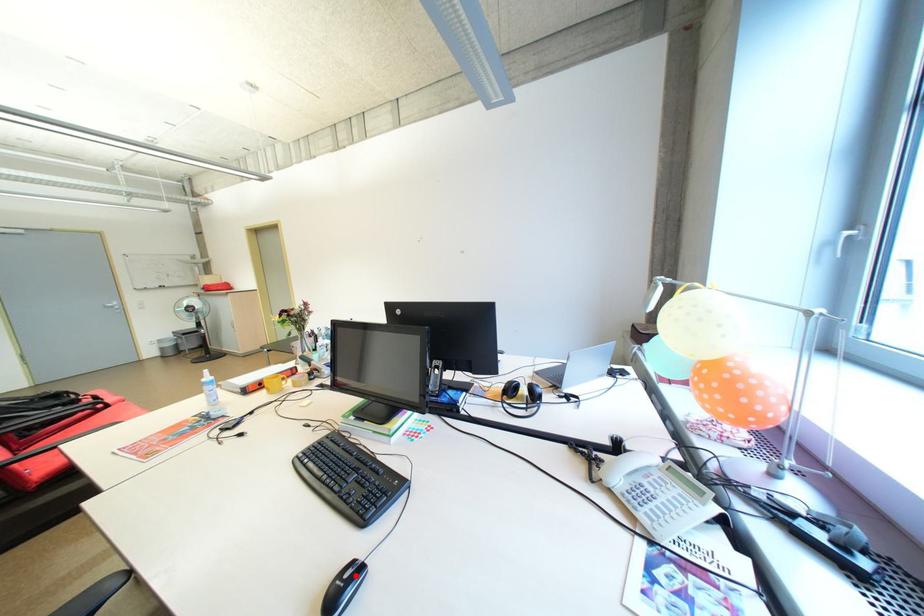
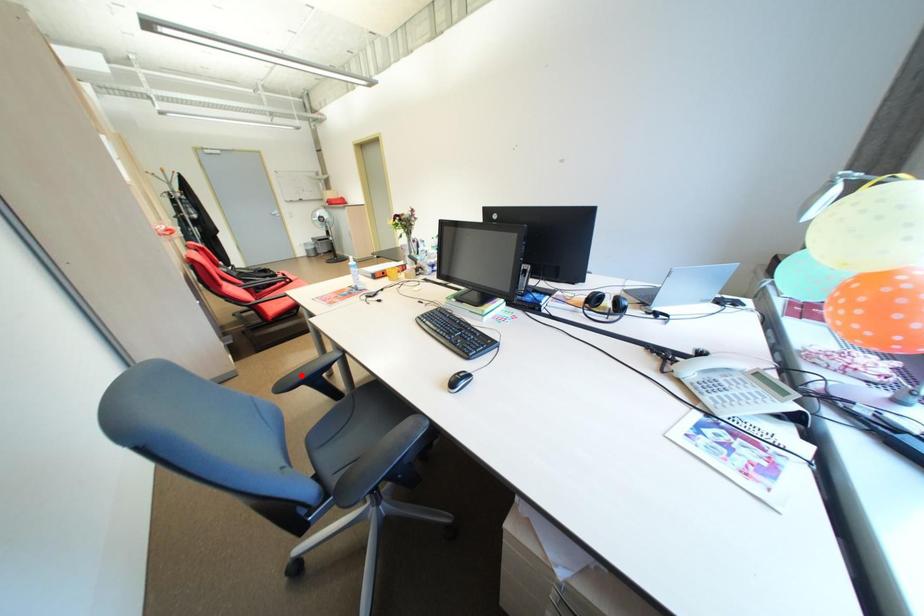
I am providing you with two images of the same scene from different viewpoints. A red point is marked on the first image and another point is marked on the second image. Are the points marked in image1 and image2 representing the same 3D position?

No